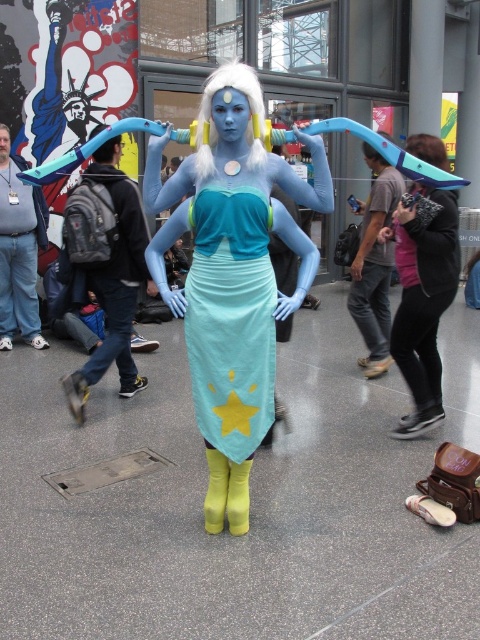
You are a photographer at the event and want to take a photo of the person in the blue and green costume. The photographer is standing at point 0.5,0.5. The black leather jacket at right is blocking the view. Where should you move to avoid the jacket?

Move to the left of the black leather jacket at right since it is positioned at point (422,301), which is to the right of the photographer at (240,320). Moving left would place the photographer to the left side of the jacket, allowing an unobstructed view of the costume.